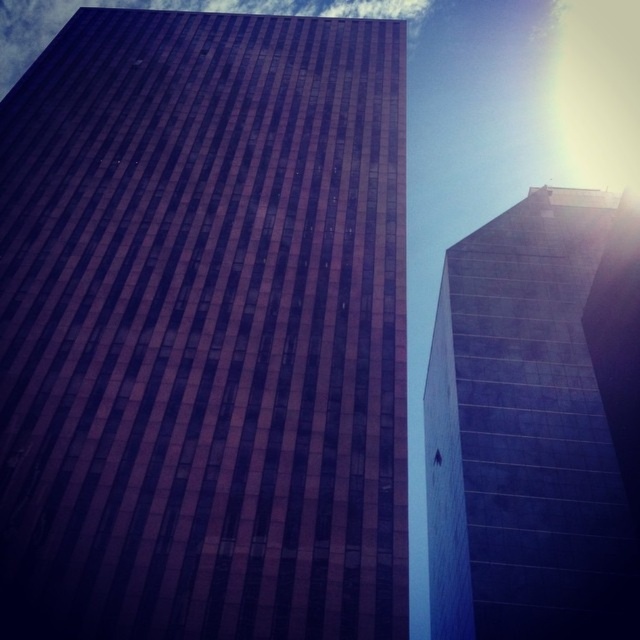
You are a drone operator trying to fly a drone between the two buildings. Given that the brown glass building at center is much taller than the smooth concrete tower at right, can you determine which building you should aim your drone to pass under first?

The brown glass building at center is much taller than the smooth concrete tower at right, so you should aim your drone to pass under the smooth concrete tower at right first since it is shorter.

You are standing in the middle of a city park looking north. You see the brown glass building at center and the smooth concrete tower at right. Which building is closer to your left side?

The brown glass building at center is to the left of the smooth concrete tower at right, so it is closer to your left side.

You are a city planner assessing the space between two buildings. The brown glass building at center and the smooth concrete tower at right are both part of a new development. Based on their widths, which building occupies more horizontal space in the city layout?

The brown glass building at center occupies more horizontal space in the city layout because its width surpasses that of the smooth concrete tower at right.